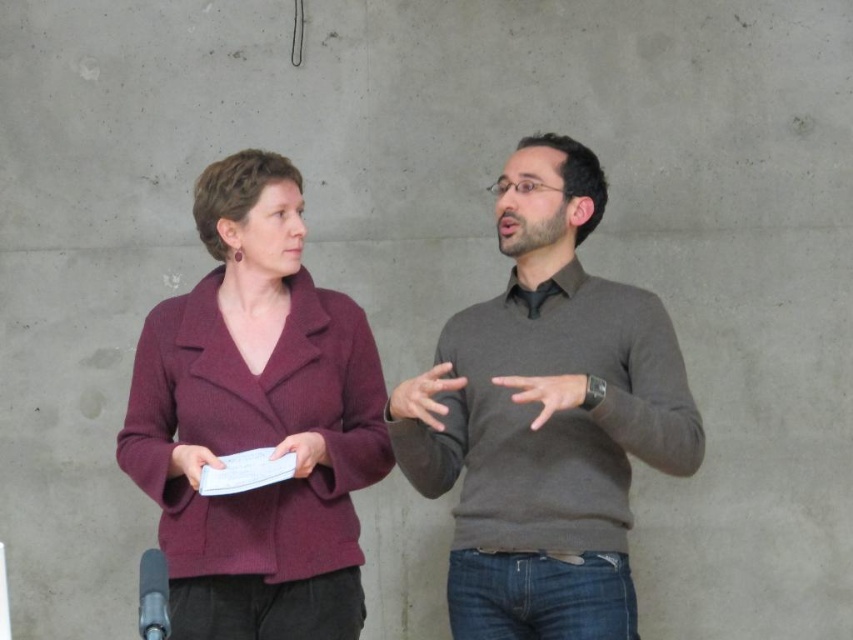
Question: Is burgundy woolen coat at left above smooth brown hand at center?

Choices:
 (A) no
 (B) yes

Answer: (B)

Question: Which of these objects is positioned farthest from the white paper at lower left?

Choices:
 (A) matte gray hand at center
 (B) white paper at center

Answer: (A)

Question: Which object is farther from the camera taking this photo?

Choices:
 (A) white paper at lower left
 (B) smooth brown hand at center
 (C) burgundy woolen coat at left
 (D) matte gray sweater at center

Answer: (C)

Question: Considering the relative positions of matte gray sweater at center and matte gray hand at center in the image provided, where is matte gray sweater at center located with respect to matte gray hand at center?

Choices:
 (A) below
 (B) above

Answer: (B)

Question: Is smooth brown hand at center above white paper at lower left?

Choices:
 (A) yes
 (B) no

Answer: (A)

Question: Which object is closer to the camera taking this photo?

Choices:
 (A) smooth brown hand at center
 (B) matte gray sweater at center

Answer: (A)